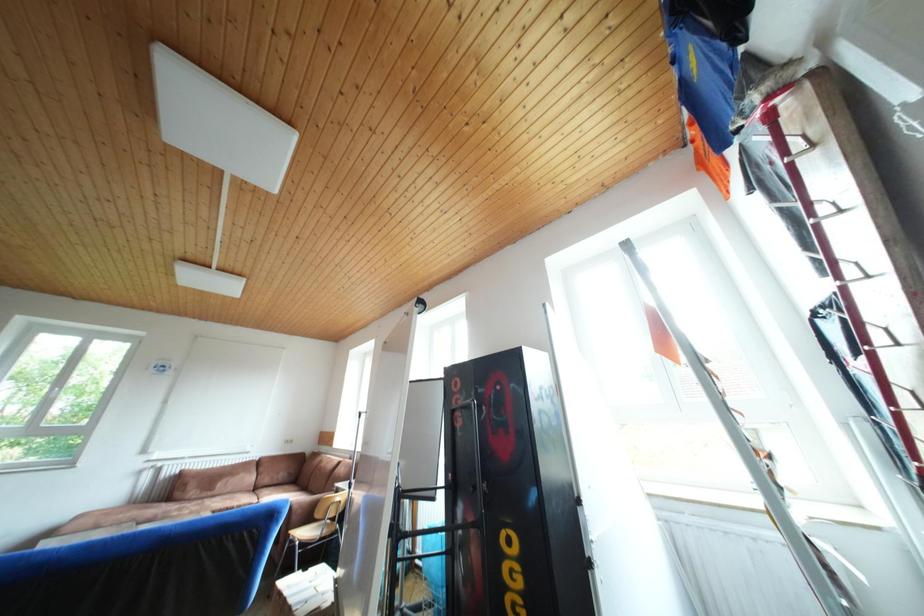
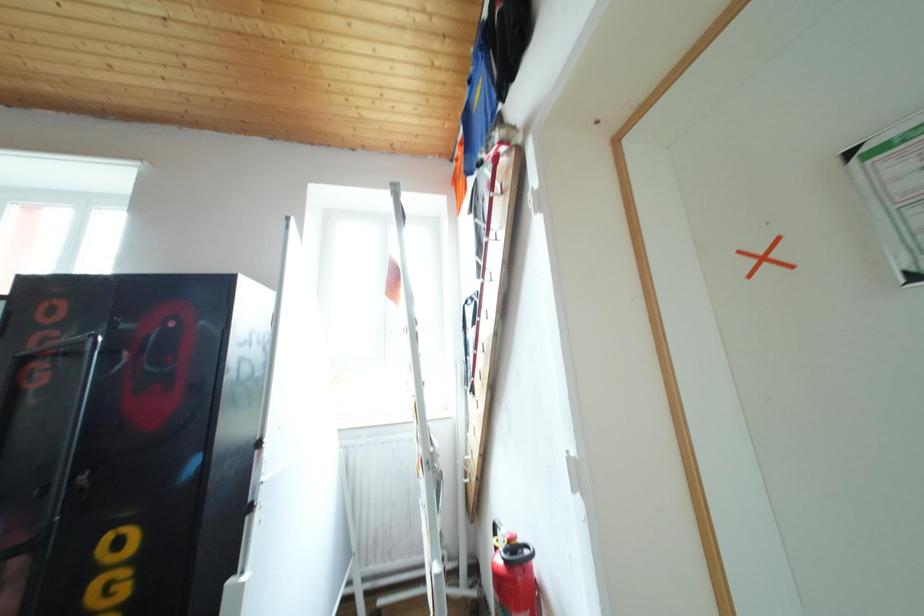
Question: How did the camera likely rotate?

Choices:
 (A) Left
 (B) Right
 (C) Up
 (D) Down

Answer: (B)